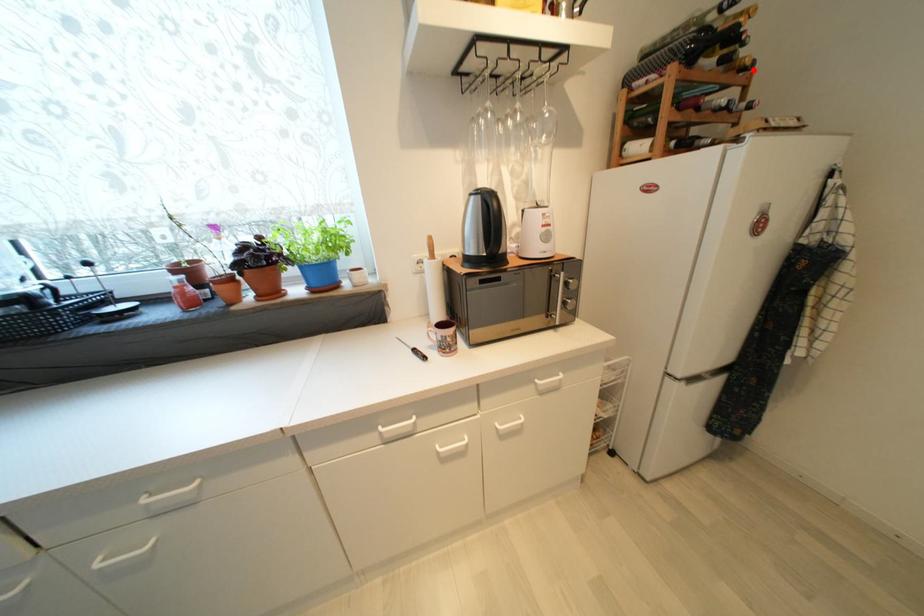
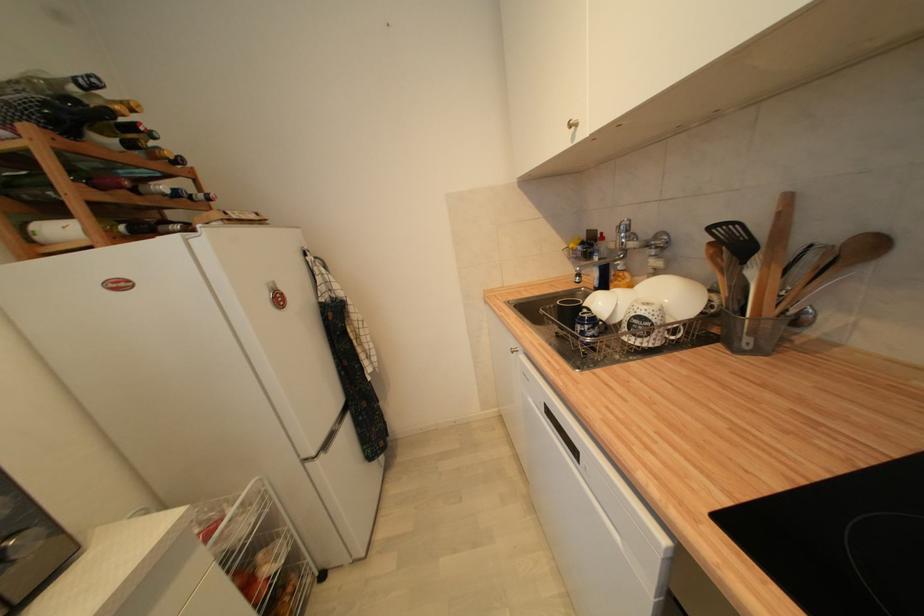
Locate, in the second image, the point that corresponds to the highlighted location in the first image.

(186, 164)